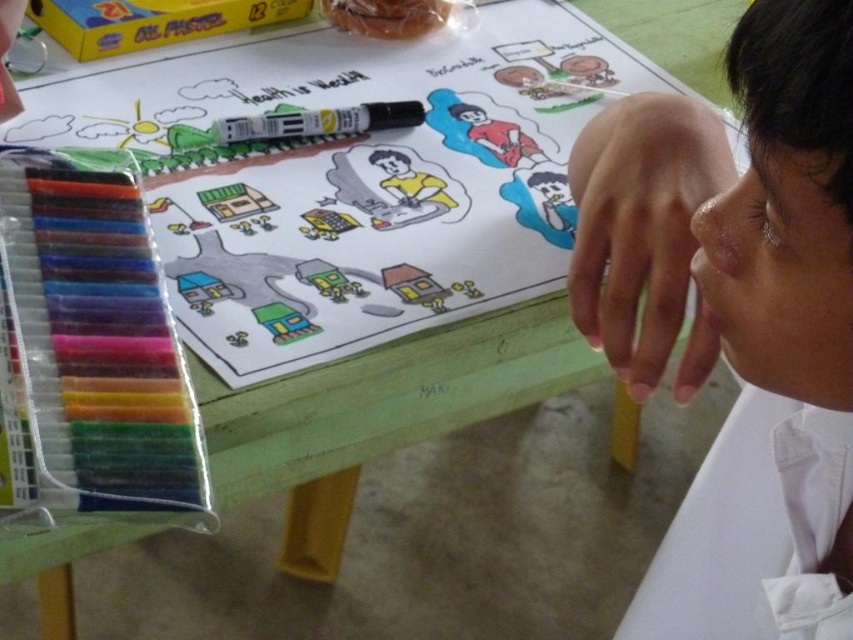
Between white smooth skin at upper right and black matte marker at center, which one is positioned higher?

black matte marker at center is above.

How distant is white smooth skin at upper right from black matte marker at center?

14.61 inches

Is point (831, 61) closer to viewer compared to point (322, 118)?

Yes, point (831, 61) is closer to viewer.

The image size is (853, 640). I want to click on white smooth skin at upper right, so pyautogui.click(x=738, y=321).